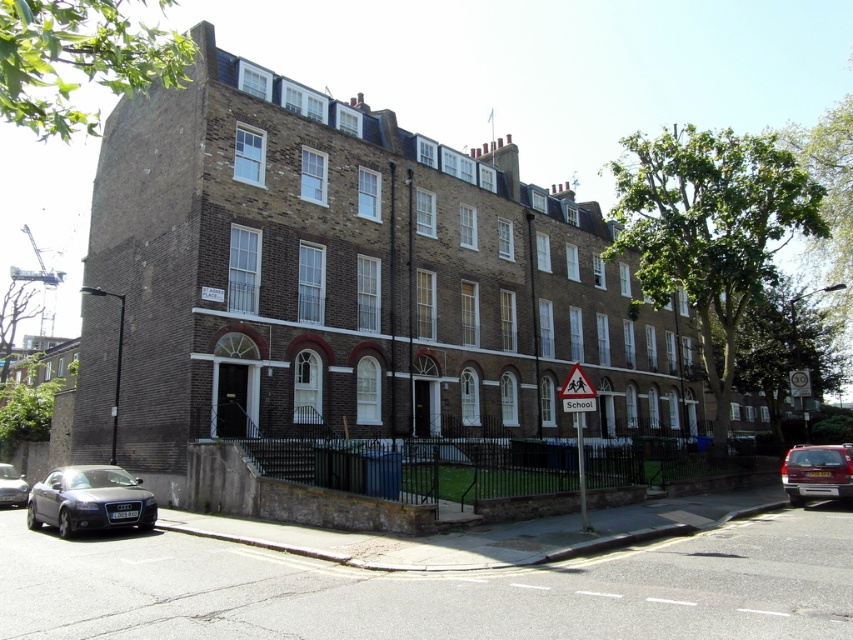
Does white plastic school sign at lower right come behind white plastic triangular at center?

Yes, it is.

Which of these two, white plastic school sign at lower right or white plastic triangular at center, stands shorter?

white plastic triangular at center

Find the location of a particular element. white plastic school sign at lower right is located at coordinates (578, 422).

Who is higher up, matte black car at lower left or white plastic school sign at lower right?

Positioned higher is white plastic school sign at lower right.

Is matte black car at lower left to the left of white plastic school sign at lower right from the viewer's perspective?

Correct, you'll find matte black car at lower left to the left of white plastic school sign at lower right.

What do you see at coordinates (90, 500) in the screenshot? I see `matte black car at lower left` at bounding box center [90, 500].

The height and width of the screenshot is (640, 853). I want to click on matte black car at lower left, so click(90, 500).

Is the position of white plastic triangular at center less distant than that of shiny silver car at lower left?

Yes, it is in front of shiny silver car at lower left.

Does white plastic triangular at center have a greater width compared to shiny silver car at lower left?

No, white plastic triangular at center is not wider than shiny silver car at lower left.

This screenshot has height=640, width=853. What are the coordinates of `white plastic triangular at center` in the screenshot? It's located at (577, 392).